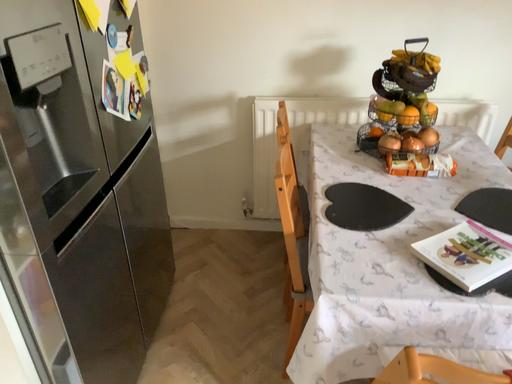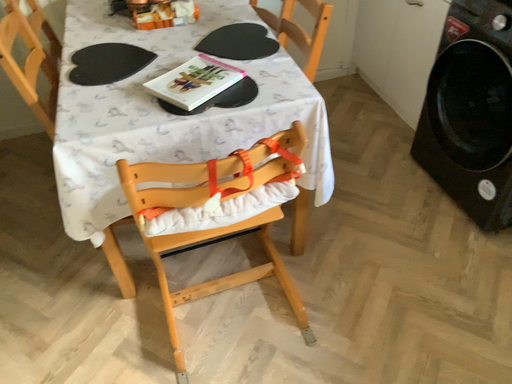
Question: How did the camera likely rotate when shooting the video?

Choices:
 (A) rotated upward
 (B) rotated downward

Answer: (B)